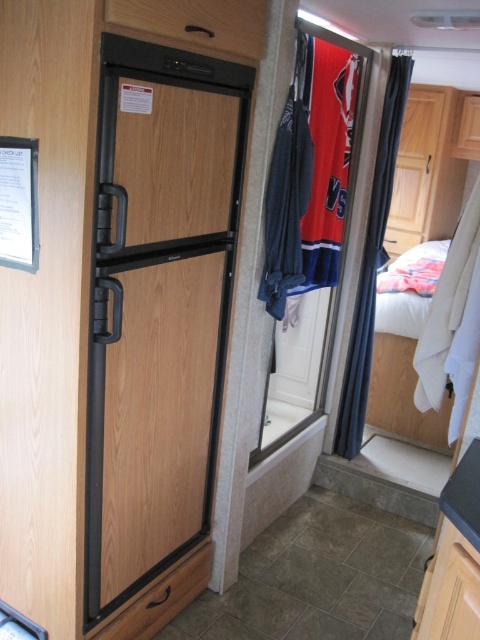
Does black matte refrigerator at center come behind black wood drawer at lower center?

No.

Can you confirm if black matte refrigerator at center is positioned to the right of black wood drawer at lower center?

Indeed, black matte refrigerator at center is positioned on the right side of black wood drawer at lower center.

Between point (93, 548) and point (173, 588), which one is positioned behind?

Point (173, 588)

Where is `black matte refrigerator at center`? This screenshot has height=640, width=480. black matte refrigerator at center is located at coordinates (158, 307).

Is point (196, 36) less distant than point (197, 550)?

Yes, point (196, 36) is closer to viewer.

Which is in front, point (224, 42) or point (175, 566)?

Point (224, 42) is more forward.

The height and width of the screenshot is (640, 480). I want to click on wooden drawer at upper center, so click(195, 22).

Locate an element on the screen. The image size is (480, 640). wooden drawer at upper center is located at coordinates (195, 22).

Image resolution: width=480 pixels, height=640 pixels. What do you see at coordinates (158, 307) in the screenshot? I see `black matte refrigerator at center` at bounding box center [158, 307].

Does black matte refrigerator at center have a lesser width compared to wooden drawer at upper center?

No, black matte refrigerator at center is not thinner than wooden drawer at upper center.

Describe the element at coordinates (158, 307) in the screenshot. The width and height of the screenshot is (480, 640). I see `black matte refrigerator at center` at that location.

Image resolution: width=480 pixels, height=640 pixels. Identify the location of black matte refrigerator at center. (158, 307).